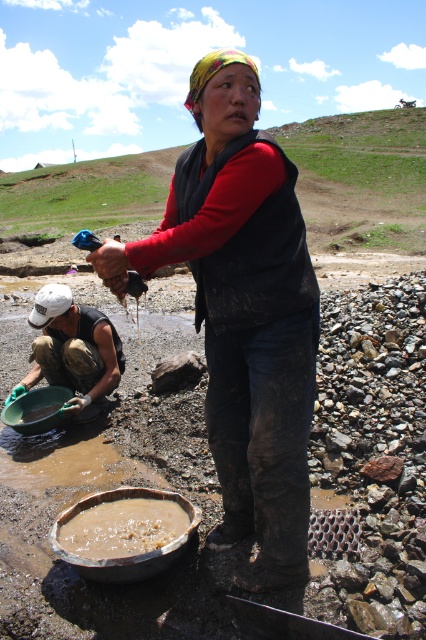
Question: Which point is farther to the camera?

Choices:
 (A) (126, 552)
 (B) (305, 369)

Answer: (A)

Question: Observing the image, what is the correct spatial positioning of white matte helmet at lower left in reference to brown clay pot at lower center?

Choices:
 (A) above
 (B) below

Answer: (A)

Question: Which is farther from the white matte helmet at lower left?

Choices:
 (A) brown clay pot at lower center
 (B) dark blue jeans at center

Answer: (B)

Question: Does dark blue jeans at center come behind white matte helmet at lower left?

Choices:
 (A) yes
 (B) no

Answer: (B)

Question: Is dark blue jeans at center smaller than brown clay pot at lower center?

Choices:
 (A) no
 (B) yes

Answer: (A)

Question: Which object appears closest to the camera in this image?

Choices:
 (A) brown clay pot at lower center
 (B) white matte helmet at lower left
 (C) dark blue jeans at center

Answer: (C)